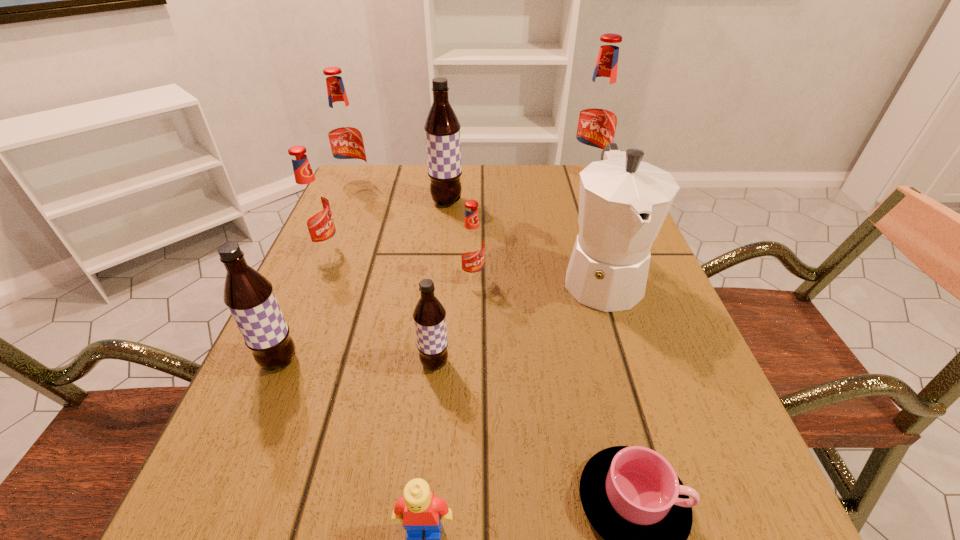
The width and height of the screenshot is (960, 540). I want to click on empty space between the biggest brown root beer and the gray coffeepot, so click(524, 239).

Where is `unoccupied position between the third farthest red root beer and the fifth farthest root beer`? The image size is (960, 540). unoccupied position between the third farthest red root beer and the fifth farthest root beer is located at coordinates (398, 265).

The image size is (960, 540). I want to click on free spot between the second biggest red root beer and the smallest brown root beer, so click(395, 275).

This screenshot has width=960, height=540. I want to click on empty space that is in between the coffeepot and the sixth root beer from left to right, so click(537, 278).

Identify which object is the ninth closest to the second red root beer from right to left. Please provide its 2D coordinates. Your answer should be formatted as a tuple, i.e. [(x, y)], where the tuple contains the x and y coordinates of a point satisfying the conditions above.

[(419, 509)]

The height and width of the screenshot is (540, 960). I want to click on object identified as the fifth closest to the red Lego, so click(x=471, y=245).

Identify which root beer is located as the seventh nearest to the ninth tallest object. Please provide its 2D coordinates. Your answer should be formatted as a tuple, i.e. [(x, y)], where the tuple contains the x and y coordinates of a point satisfying the conditions above.

[(597, 119)]

Find the location of `root beer that stands as the fourth closest to the biggest brown root beer`. root beer that stands as the fourth closest to the biggest brown root beer is located at coordinates (597, 119).

You are a GUI agent. You are given a task and a screenshot of the screen. Output one action in this format:
    pyautogui.click(x=<x>, y=<y>)
    Task: Click on the red root beer that can be found as the fourth closest to the cup
    
    Given the screenshot: What is the action you would take?
    pyautogui.click(x=345, y=137)

Locate an element on the screen. The height and width of the screenshot is (540, 960). the closest red root beer to the red Lego is located at coordinates pos(471,245).